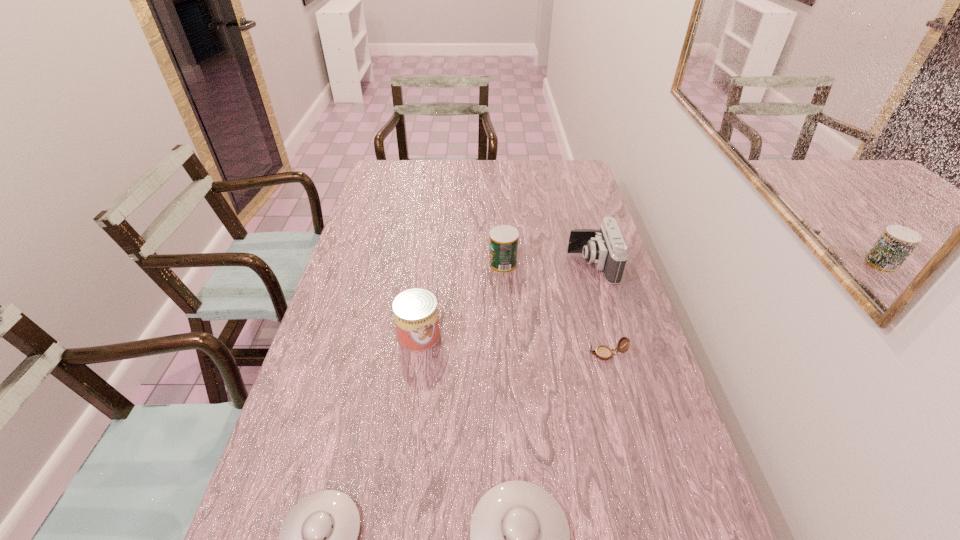
Find the location of a particular element. vacant space located on the face of the compass is located at coordinates (541, 354).

Where is `vacant space located on the face of the compass`? vacant space located on the face of the compass is located at coordinates (481, 354).

Find the location of a particular element. vacant space situated 0.280m on the face of the compass is located at coordinates [481, 354].

Identify the location of camera that is at the right edge. Image resolution: width=960 pixels, height=540 pixels. (606, 248).

The width and height of the screenshot is (960, 540). Find the location of `compass positioned at the right edge`. compass positioned at the right edge is located at coordinates (603, 352).

In the image, there is a desktop. At what (x,y) coordinates should I click in order to perform the action: click on vacant space at the far edge. Please return your answer as a coordinate pair (x, y). The width and height of the screenshot is (960, 540). Looking at the image, I should click on (520, 171).

In the image, there is a desktop. Identify the location of free space at the left edge. The width and height of the screenshot is (960, 540). (348, 300).

Locate an element on the screen. This screenshot has height=540, width=960. free region at the right edge of the desktop is located at coordinates (635, 356).

Image resolution: width=960 pixels, height=540 pixels. In the image, there is a desktop. Identify the location of vacant area at the far left corner. tap(385, 187).

Locate an element on the screen. This screenshot has height=540, width=960. unoccupied area between the second object from left to right and the camera is located at coordinates (506, 300).